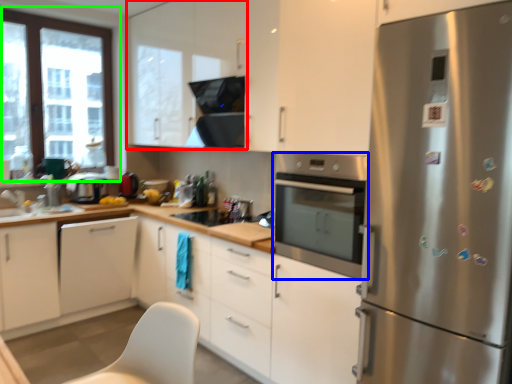
Question: Estimate the real-world distances between objects in this image. Which object is farther from cabinetry (highlighted by a red box), home appliance (highlighted by a blue box) or window (highlighted by a green box)?

Choices:
 (A) home appliance
 (B) window

Answer: (A)